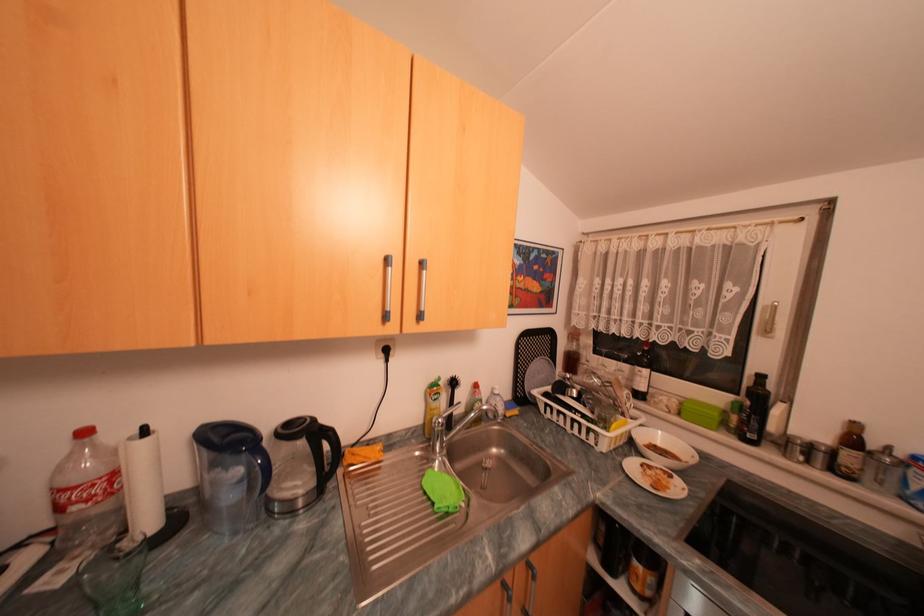
You are a GUI agent. You are given a task and a screenshot of the screen. Output one action in this format:
    pyautogui.click(x=<x>, y=<y>)
    Task: Click on the white spray bottle
    The image size is (924, 616).
    Given the screenshot: What is the action you would take?
    pyautogui.click(x=87, y=492)